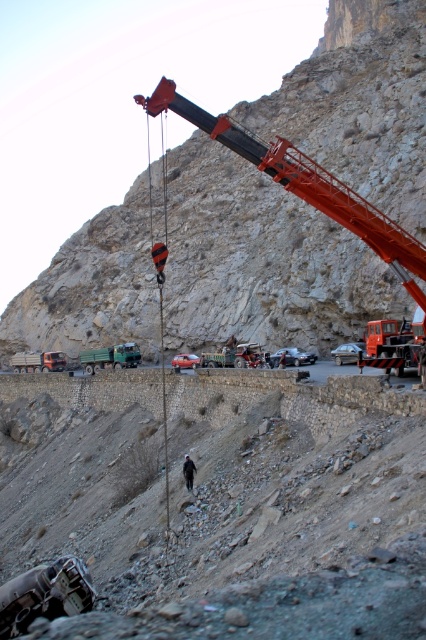
Does rough stone hillside at upper center appear under metallic silver sedan at center?

Incorrect, rough stone hillside at upper center is not positioned below metallic silver sedan at center.

Does rough stone hillside at upper center appear over metallic silver sedan at center?

Indeed, rough stone hillside at upper center is positioned over metallic silver sedan at center.

Is point (192, 326) more distant than point (353, 362)?

That is True.

Locate an element on the screen. This screenshot has height=640, width=426. rough stone hillside at upper center is located at coordinates (261, 260).

Does point (276, 364) come closer to viewer compared to point (175, 358)?

Yes, it is.

Can you confirm if shiny silver sedan at center is positioned below metallic silver car at center?

Actually, shiny silver sedan at center is above metallic silver car at center.

Where is `shiny silver sedan at center`? shiny silver sedan at center is located at coordinates (293, 356).

Who is more forward, [336,362] or [190,362]?

Point [336,362]

Describe the element at coordinates (348, 353) in the screenshot. I see `metallic silver sedan at center` at that location.

The height and width of the screenshot is (640, 426). In order to click on metallic silver sedan at center in this screenshot , I will do `click(348, 353)`.